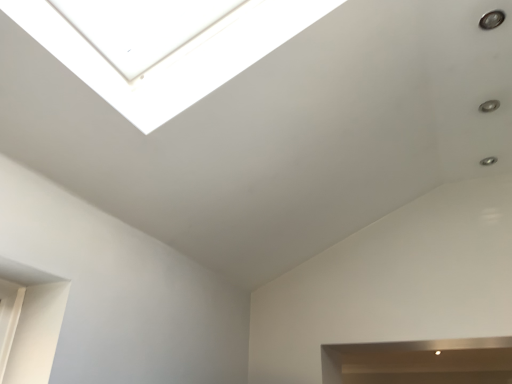
Identify the location of transparent glass window at upper center. (172, 55).

What do you see at coordinates (172, 55) in the screenshot?
I see `transparent glass window at upper center` at bounding box center [172, 55].

Find the location of a particular element. The height and width of the screenshot is (384, 512). transparent glass window at upper center is located at coordinates (172, 55).